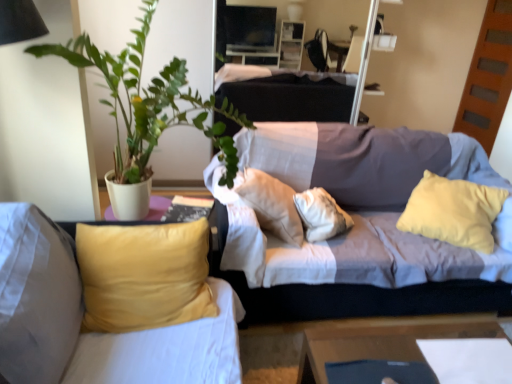
Question: Considering the relative sizes of velvet yellow pillow at left, which ranks as the 2th studio couch in right-to-left order, and wooden table at lower right in the image provided, is velvet yellow pillow at left, which ranks as the 2th studio couch in right-to-left order, taller than wooden table at lower right?

Choices:
 (A) yes
 (B) no

Answer: (A)

Question: Does velvet yellow pillow at left, which ranks as the 2th studio couch in right-to-left order, turn towards wooden table at lower right?

Choices:
 (A) no
 (B) yes

Answer: (A)

Question: Would you say wooden table at lower right is part of velvet yellow pillow at left, the 1th studio couch positioned from the left,'s contents?

Choices:
 (A) yes
 (B) no

Answer: (B)

Question: Considering the relative sizes of velvet yellow pillow at left, the 1th studio couch positioned from the left, and wooden table at lower right in the image provided, is velvet yellow pillow at left, the 1th studio couch positioned from the left, shorter than wooden table at lower right?

Choices:
 (A) no
 (B) yes

Answer: (A)

Question: Is velvet yellow pillow at left, which ranks as the 2th studio couch in right-to-left order, looking in the opposite direction of wooden table at lower right?

Choices:
 (A) yes
 (B) no

Answer: (B)

Question: In the image, is velvet yellow pillow at left, which ranks as the 2th studio couch in right-to-left order, positioned in front of or behind green leafy plant at upper left?

Choices:
 (A) behind
 (B) front

Answer: (A)

Question: Is velvet yellow pillow at left, the 1th studio couch positioned from the left, wider or thinner than green leafy plant at upper left?

Choices:
 (A) thin
 (B) wide

Answer: (A)

Question: Choose the correct answer: Is velvet yellow pillow at left, the 1th studio couch positioned from the left, inside green leafy plant at upper left or outside it?

Choices:
 (A) inside
 (B) outside

Answer: (B)

Question: Looking at the image, does velvet yellow pillow at left, the 1th studio couch positioned from the left, seem bigger or smaller compared to green leafy plant at upper left?

Choices:
 (A) small
 (B) big

Answer: (A)

Question: Considering their positions, is textured gray couch at center, the 1th studio couch from the right, located in front of or behind velvet yellow pillow at left, which ranks as the 2th studio couch in right-to-left order?

Choices:
 (A) behind
 (B) front

Answer: (A)

Question: Considering the positions of textured gray couch at center, which is counted as the 2th studio couch, starting from the left, and velvet yellow pillow at left, the 1th studio couch positioned from the left, in the image, is textured gray couch at center, which is counted as the 2th studio couch, starting from the left, wider or thinner than velvet yellow pillow at left, the 1th studio couch positioned from the left,?

Choices:
 (A) wide
 (B) thin

Answer: (A)

Question: Is textured gray couch at center, the 1th studio couch from the right, to the left or to the right of velvet yellow pillow at left, which ranks as the 2th studio couch in right-to-left order, in the image?

Choices:
 (A) right
 (B) left

Answer: (A)

Question: From a real-world perspective, is textured gray couch at center, the 1th studio couch from the right, positioned above or below velvet yellow pillow at left, the 1th studio couch positioned from the left?

Choices:
 (A) below
 (B) above

Answer: (A)

Question: From their relative heights in the image, would you say velvet yellow pillow at left, which ranks as the 2th studio couch in right-to-left order, is taller or shorter than textured gray couch at center, which is counted as the 2th studio couch, starting from the left?

Choices:
 (A) tall
 (B) short

Answer: (B)

Question: Is velvet yellow pillow at left, which ranks as the 2th studio couch in right-to-left order, inside the boundaries of textured gray couch at center, which is counted as the 2th studio couch, starting from the left, or outside?

Choices:
 (A) outside
 (B) inside

Answer: (A)